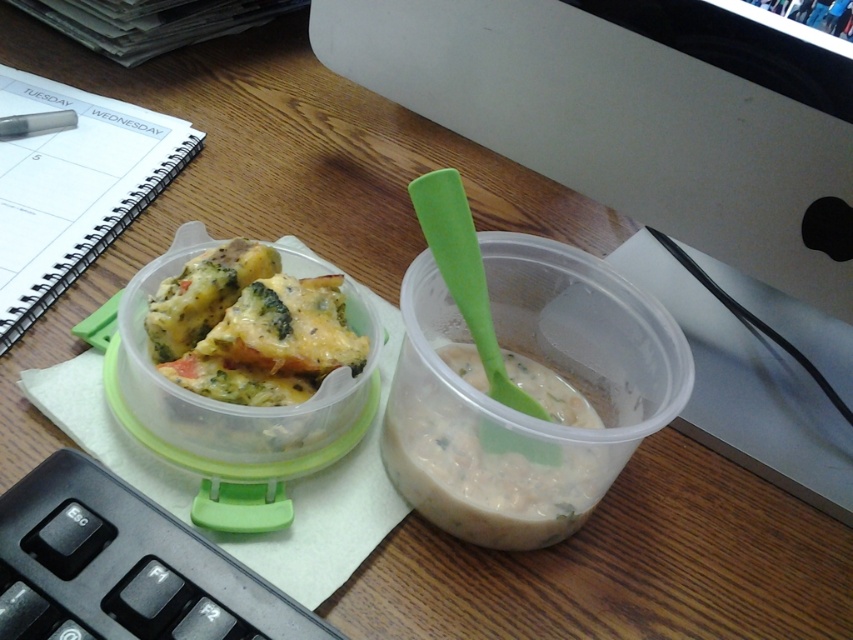
Is black plastic keyboard at lower left to the left of metallic silver pen at upper left from the viewer's perspective?

No, black plastic keyboard at lower left is not to the left of metallic silver pen at upper left.

Is point (38, 518) behind point (26, 115)?

No.

You are a GUI agent. You are given a task and a screenshot of the screen. Output one action in this format:
    pyautogui.click(x=<x>, y=<y>)
    Task: Click on the black plastic keyboard at lower left
    
    Given the screenshot: What is the action you would take?
    pyautogui.click(x=125, y=566)

Which is more to the left, white creamy soup at center or metallic silver pen at upper left?

Positioned to the left is metallic silver pen at upper left.

Which is behind, point (523, 436) or point (18, 131)?

The point (18, 131) is behind.

Identify the location of white creamy soup at center. This screenshot has height=640, width=853. (483, 467).

Measure the distance between cheesy broccoli casserole at left and metallic silver pen at upper left.

cheesy broccoli casserole at left is 11.24 inches from metallic silver pen at upper left.

Is cheesy broccoli casserole at left closer to the viewer compared to metallic silver pen at upper left?

Yes, cheesy broccoli casserole at left is closer to the viewer.

You are a GUI agent. You are given a task and a screenshot of the screen. Output one action in this format:
    pyautogui.click(x=<x>, y=<y>)
    Task: Click on the cheesy broccoli casserole at left
    Image resolution: width=853 pixels, height=640 pixels.
    Given the screenshot: What is the action you would take?
    pyautogui.click(x=223, y=396)

Find the location of `cheesy broccoli casserole at left`. cheesy broccoli casserole at left is located at coordinates (223, 396).